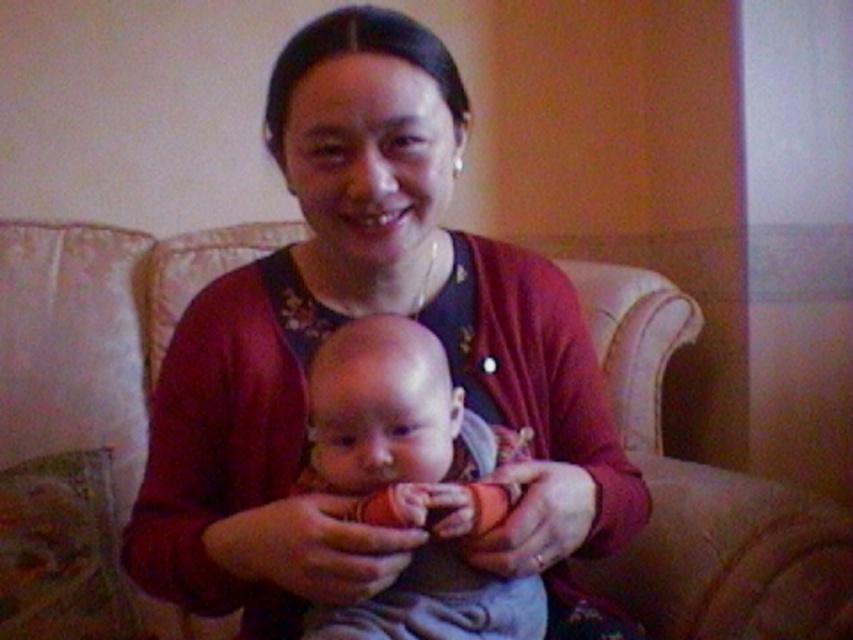
Question: Considering the relative positions of matte red cardigan at center and beige fabric couch at center in the image provided, where is matte red cardigan at center located with respect to beige fabric couch at center?

Choices:
 (A) above
 (B) below

Answer: (A)

Question: Estimate the real-world distances between objects in this image. Which object is farther from the smooth skin baby at center?

Choices:
 (A) matte red cardigan at center
 (B) beige fabric couch at center

Answer: (B)

Question: Can you confirm if beige fabric couch at center is thinner than smooth skin baby at center?

Choices:
 (A) yes
 (B) no

Answer: (B)

Question: Is matte red cardigan at center smaller than smooth skin baby at center?

Choices:
 (A) no
 (B) yes

Answer: (A)

Question: Which object is the closest to the matte red cardigan at center?

Choices:
 (A) beige fabric couch at center
 (B) smooth skin baby at center

Answer: (B)

Question: Which point is closer to the camera?

Choices:
 (A) (337, 360)
 (B) (599, 353)

Answer: (A)